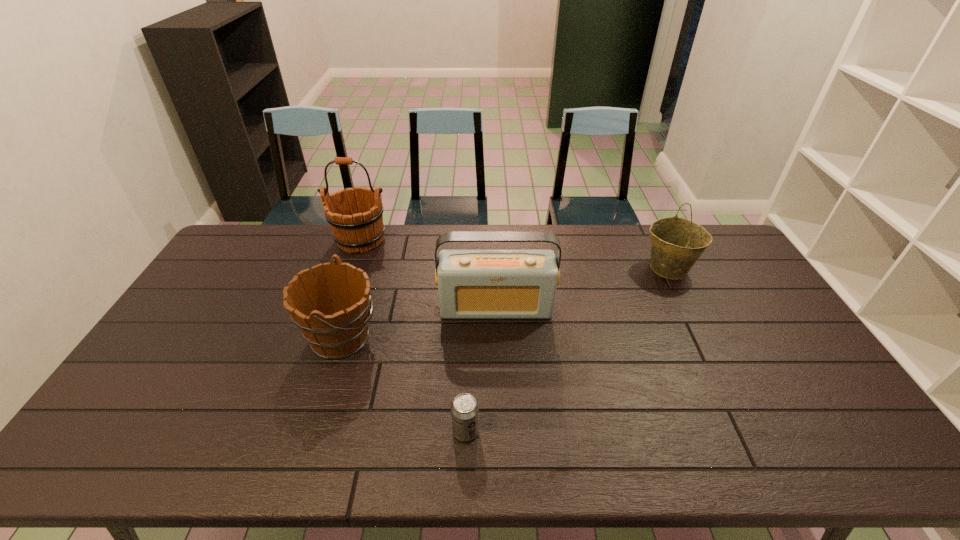
Select which wine bucket is the closest to the shortest wine bucket. Please provide its 2D coordinates. Your answer should be formatted as a tuple, i.e. [(x, y)], where the tuple contains the x and y coordinates of a point satisfying the conditions above.

[(355, 216)]

Identify the location of free spot that satisfies the following two spatial constraints: 1. on the front-facing side of the radio receiver; 2. with the handle on the shortest wine bucket. This screenshot has width=960, height=540. (497, 338).

Where is `vacant space that satisfies the following two spatial constraints: 1. on the front-facing side of the radio receiver; 2. with the handle on the shortest wine bucket`? vacant space that satisfies the following two spatial constraints: 1. on the front-facing side of the radio receiver; 2. with the handle on the shortest wine bucket is located at coordinates (497, 338).

Locate an element on the screen. The width and height of the screenshot is (960, 540). vacant space that satisfies the following two spatial constraints: 1. on the back side of the rightmost wine bucket; 2. on the left side of the beer can is located at coordinates (470, 268).